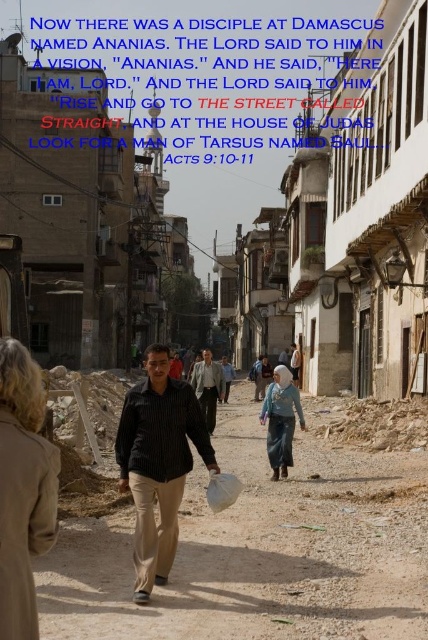
In the scene shown: You are standing on the narrow street scene and want to take a photo. There are two points of interest marked as point 1 at coordinates (166, 369) and point 2 at coordinates (290, 365). Which point should you focus on first if you want to capture the closest one to your camera?

Point 1 at coordinates (166, 369) is closer to the camera than point 2 at coordinates (290, 365), so you should focus on point 1 first.

You are a delivery person trying to navigate through the narrow street. You see the brown dirt road at center and the black striped shirt at center. Which one is closer to you as you walk along the street?

The brown dirt road at center is closer because it is in front of the black striped shirt at center.